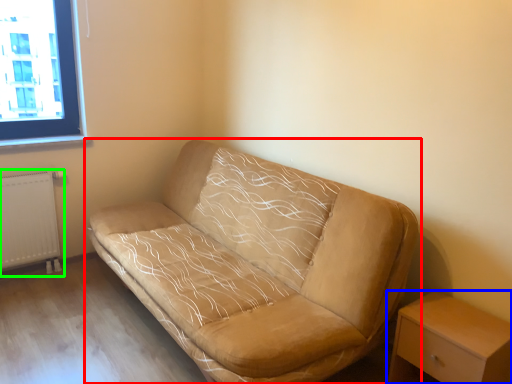
Question: Based on their relative distances, which object is nearer to studio couch (highlighted by a red box)? Choose from nightstand (highlighted by a blue box) and radiator (highlighted by a green box).

Choices:
 (A) nightstand
 (B) radiator

Answer: (A)